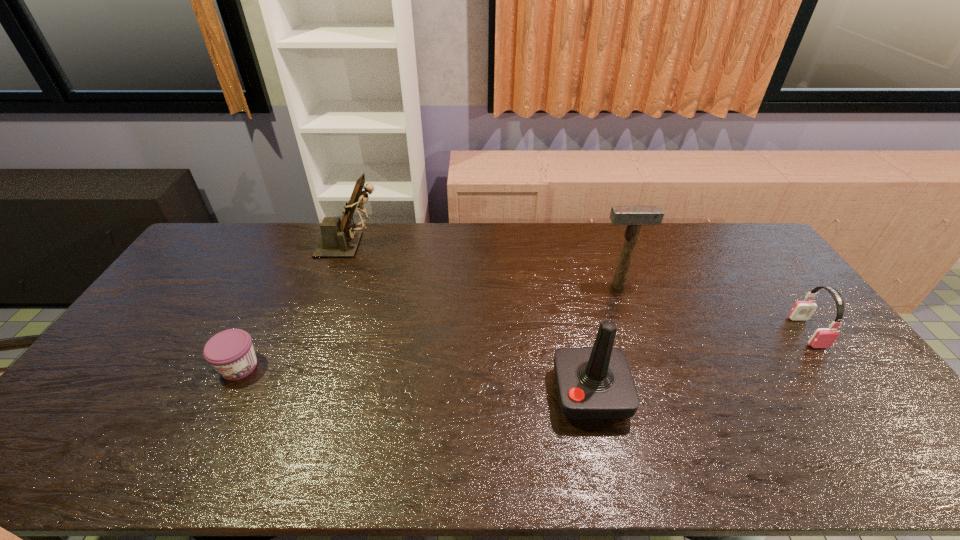
This screenshot has width=960, height=540. I want to click on figurine, so click(339, 239).

The height and width of the screenshot is (540, 960). What are the coordinates of `the farthest object` in the screenshot? It's located at tap(339, 239).

Locate an element on the screen. Image resolution: width=960 pixels, height=540 pixels. the fourth nearest object is located at coordinates (633, 216).

The image size is (960, 540). I want to click on mallet, so click(633, 216).

Where is `joystick`? Image resolution: width=960 pixels, height=540 pixels. joystick is located at coordinates (595, 383).

Image resolution: width=960 pixels, height=540 pixels. Find the location of `the third farthest object`. the third farthest object is located at coordinates (x=802, y=310).

The width and height of the screenshot is (960, 540). Find the location of `earphone`. earphone is located at coordinates (802, 310).

Identify the location of the shortest object. (231, 353).

In order to click on the leftmost object in this screenshot , I will do pos(231,353).

You are a GUI agent. You are given a task and a screenshot of the screen. Output one action in this format:
    pyautogui.click(x=<x>, y=<y>)
    Task: Click on the free location located 0.140m on the front-facing side of the farthest object
    The width and height of the screenshot is (960, 540).
    Given the screenshot: What is the action you would take?
    pyautogui.click(x=422, y=245)